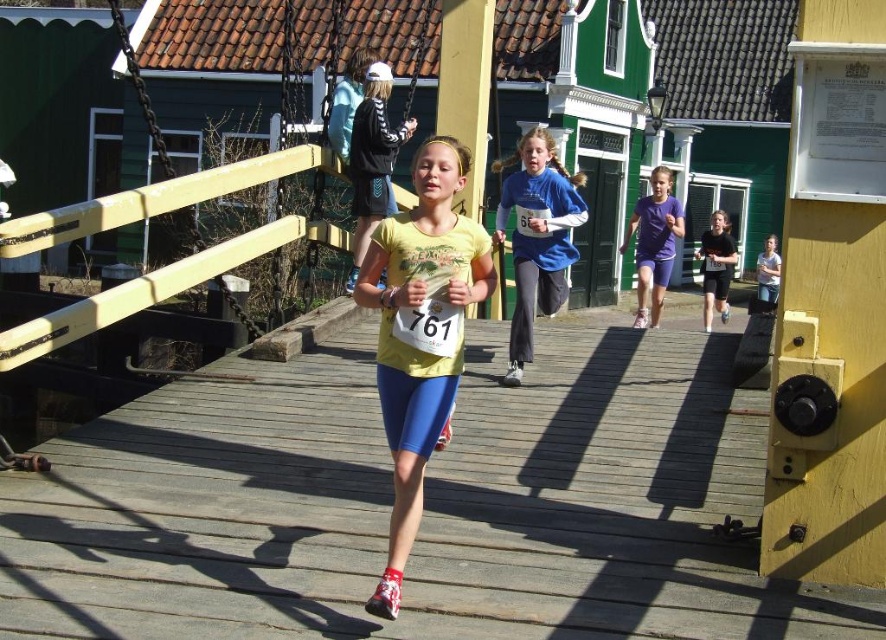
Question: Which object is positioned closest to the blue fabric shirt at center?

Choices:
 (A) matte black shorts at center
 (B) light blue fabric shirt at center
 (C) purple matte shorts at right
 (D) yellow matte t-shirt at center

Answer: (D)

Question: Does blue fabric shirt at center appear on the left side of matte black jacket at upper left?

Choices:
 (A) yes
 (B) no

Answer: (B)

Question: Can you confirm if blue fabric shirt at center is positioned above matte black shorts at center?

Choices:
 (A) no
 (B) yes

Answer: (B)

Question: Which point appears farthest from the camera in this image?

Choices:
 (A) (642, 280)
 (B) (774, 264)

Answer: (B)

Question: Which point is farther to the camera?

Choices:
 (A) matte black jacket at upper left
 (B) light blue fabric shirt at center

Answer: (B)

Question: Is blue fabric shirt at center thinner than matte black shorts at center?

Choices:
 (A) no
 (B) yes

Answer: (B)